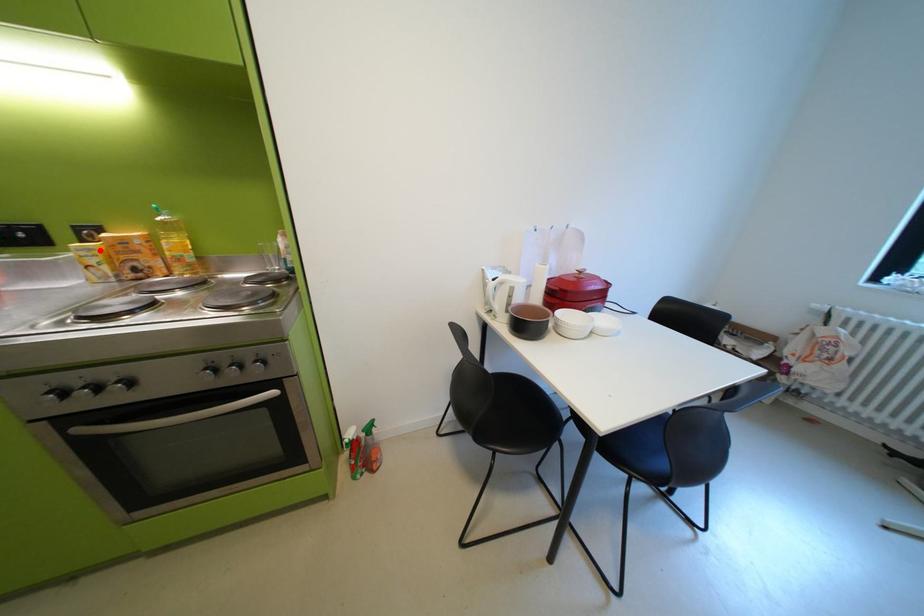
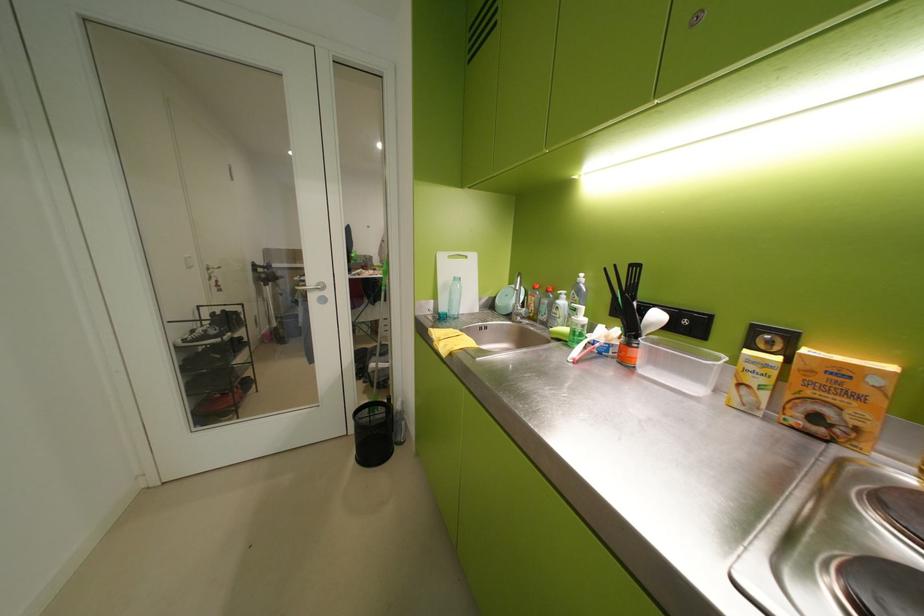
In the second image, find the point that corresponds to the highlighted location in the first image.

(773, 365)